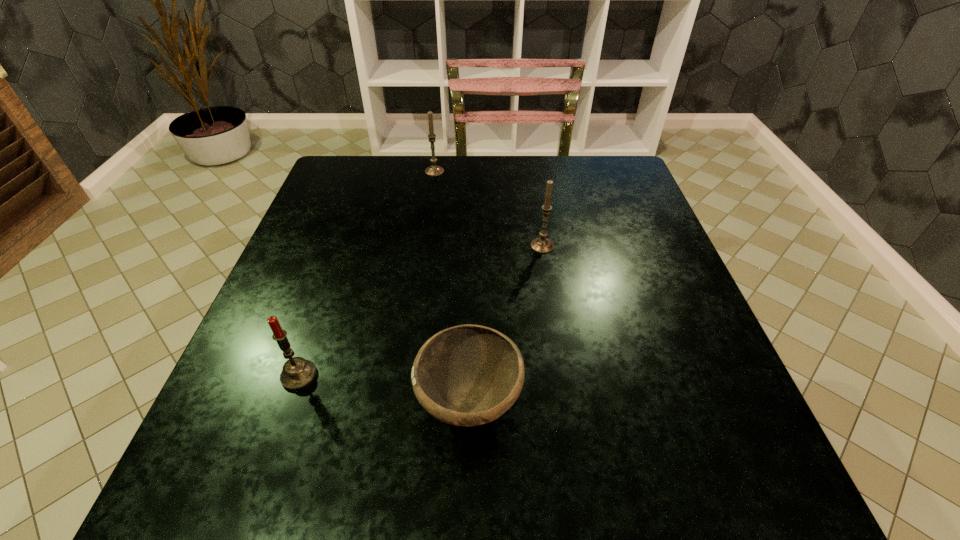
At what (x,y) coordinates should I click in order to perform the action: click on empty location between the rightmost object and the bowl. Please return your answer as a coordinate pair (x, y). Looking at the image, I should click on (506, 324).

Locate which object is the third closest to the second farthest object. Please provide its 2D coordinates. Your answer should be formatted as a tuple, i.e. [(x, y)], where the tuple contains the x and y coordinates of a point satisfying the conditions above.

[(298, 373)]

Choose which object is the nearest neighbor to the leftmost candle. Please provide its 2D coordinates. Your answer should be formatted as a tuple, i.e. [(x, y)], where the tuple contains the x and y coordinates of a point satisfying the conditions above.

[(467, 375)]

At what (x,y) coordinates should I click in order to perform the action: click on candle identified as the second closest to the bowl. Please return your answer as a coordinate pair (x, y). The image size is (960, 540). Looking at the image, I should click on click(540, 245).

The height and width of the screenshot is (540, 960). I want to click on candle that can be found as the closest to the nearest candle, so click(x=540, y=245).

At what (x,y) coordinates should I click in order to perform the action: click on free location that satisfies the following two spatial constraints: 1. on the front side of the shortest object; 2. on the left side of the nearest candle. Please return your answer as a coordinate pair (x, y). Looking at the image, I should click on (290, 401).

Where is `free space that satisfies the following two spatial constraints: 1. on the front side of the nearest candle; 2. on the right side of the bowl`? The height and width of the screenshot is (540, 960). free space that satisfies the following two spatial constraints: 1. on the front side of the nearest candle; 2. on the right side of the bowl is located at coordinates (290, 401).

What are the coordinates of `blank space that satisfies the following two spatial constraints: 1. on the front side of the bowl; 2. on the left side of the leftmost candle` in the screenshot? It's located at (290, 401).